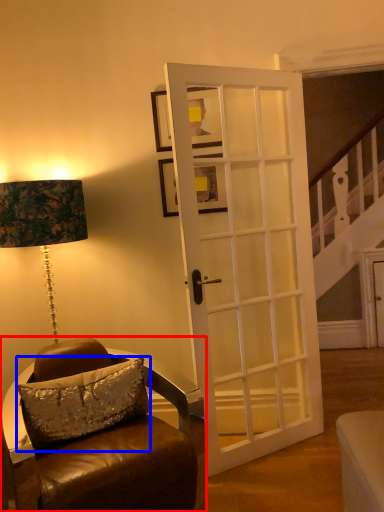
Question: Which object appears closest to the camera in this image, chair (highlighted by a red box) or pillow (highlighted by a blue box)?

Choices:
 (A) chair
 (B) pillow

Answer: (A)